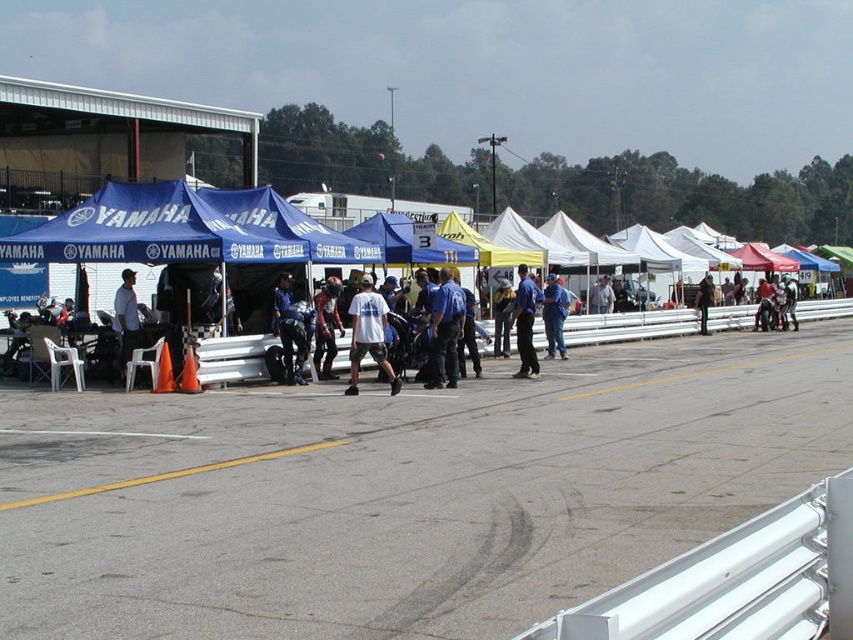
Question: Is white metallic barrier at center positioned in front of blue uniform at center?

Choices:
 (A) yes
 (B) no

Answer: (A)

Question: Which object is positioned closest to the blue uniformed officer at center?

Choices:
 (A) white jersey at center
 (B) white metallic barrier at center

Answer: (A)

Question: Is blue uniformed officer at center wider than leather jacket at center?

Choices:
 (A) no
 (B) yes

Answer: (B)

Question: Which point is closer to the camera?

Choices:
 (A) (338, 323)
 (B) (704, 330)

Answer: (A)

Question: Which object appears closest to the camera in this image?

Choices:
 (A) blue uniform at center
 (B) yellow asphalt at lower center
 (C) dark blue uniform at center
 (D) leather jacket at center

Answer: (B)

Question: Where is white cotton t-shirt at center located in relation to light blue shirt at center in the image?

Choices:
 (A) below
 (B) above

Answer: (A)